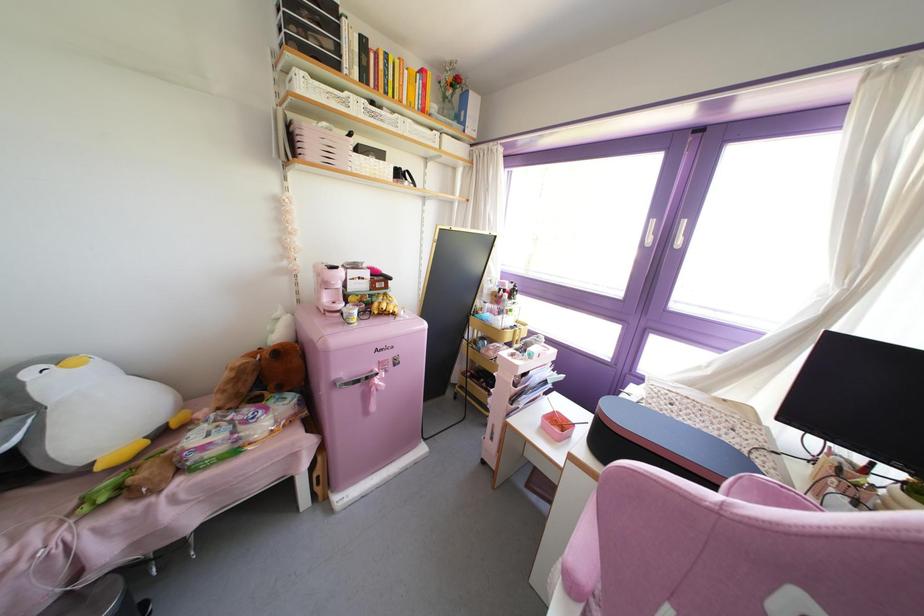
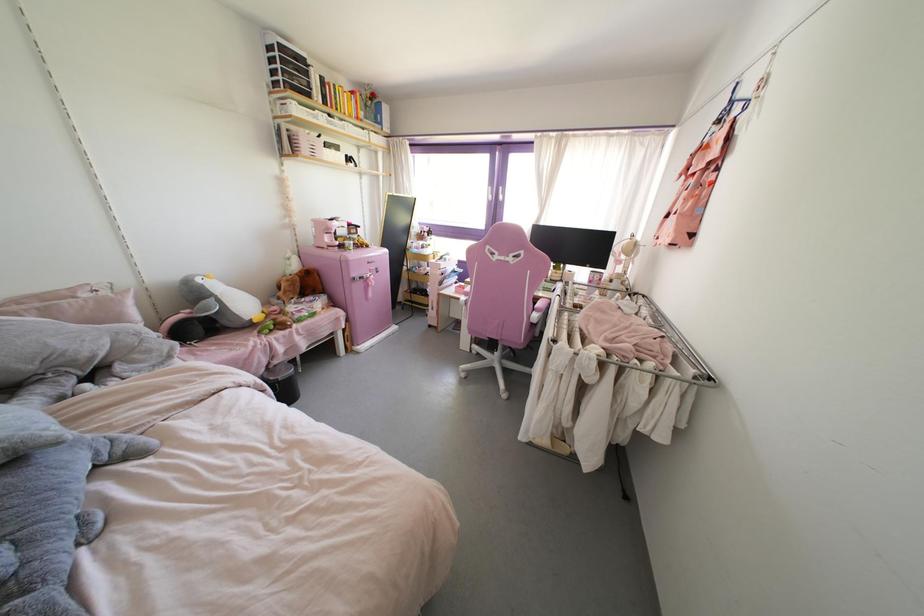
Which direction would the cameraman need to move to produce the second image?

The cameraman walked toward left, backward.